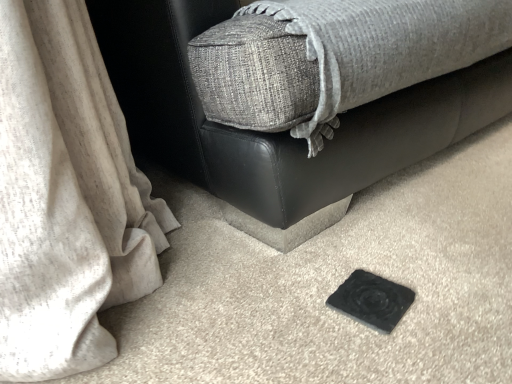
This screenshot has height=384, width=512. What do you see at coordinates (276, 133) in the screenshot?
I see `black matte coaster at lower center` at bounding box center [276, 133].

You are a GUI agent. You are given a task and a screenshot of the screen. Output one action in this format:
    pyautogui.click(x=<x>, y=<y>)
    Task: Click on the black matte coaster at lower center
    The image size is (512, 384).
    Given the screenshot: What is the action you would take?
    pyautogui.click(x=276, y=133)

Where is `black rubber pad at lower center`? The image size is (512, 384). black rubber pad at lower center is located at coordinates (372, 300).

The height and width of the screenshot is (384, 512). What do you see at coordinates (372, 300) in the screenshot?
I see `black rubber pad at lower center` at bounding box center [372, 300].

Looking at this image, in order to face black rubber pad at lower center, should I rotate leftwards or rightwards?

You should rotate right by 14.370 degrees.

Where is `black matte coaster at lower center`? This screenshot has height=384, width=512. black matte coaster at lower center is located at coordinates (276, 133).

Would you say black rubber pad at lower center is to the left or to the right of black matte coaster at lower center in the picture?

black rubber pad at lower center is positioned on black matte coaster at lower center's left side.

Is the depth of black rubber pad at lower center greater than that of black matte coaster at lower center?

Yes, it is.

Which point is more forward, (383, 286) or (101, 35)?

Positioned in front is point (383, 286).

From the image's perspective, which one is positioned higher, black rubber pad at lower center or black matte coaster at lower center?

black matte coaster at lower center.

From a real-world perspective, which is physically below, black rubber pad at lower center or black matte coaster at lower center?

black rubber pad at lower center.

Between black rubber pad at lower center and black matte coaster at lower center, which one has smaller width?

Thinner between the two is black rubber pad at lower center.

Does black rubber pad at lower center have a greater height compared to black matte coaster at lower center?

Incorrect, the height of black rubber pad at lower center is not larger of that of black matte coaster at lower center.

Looking at the image, does black rubber pad at lower center seem bigger or smaller compared to black matte coaster at lower center?

Clearly, black rubber pad at lower center is smaller in size than black matte coaster at lower center.

Is black rubber pad at lower center spatially inside black matte coaster at lower center, or outside of it?

black rubber pad at lower center is located beyond the bounds of black matte coaster at lower center.

Is black rubber pad at lower center placed right next to black matte coaster at lower center?

No, black rubber pad at lower center is not in contact with black matte coaster at lower center.

Is black rubber pad at lower center aimed at black matte coaster at lower center?

Yes, black rubber pad at lower center faces towards black matte coaster at lower center.

The width and height of the screenshot is (512, 384). I want to click on pad on the left of black matte coaster at lower center, so click(x=372, y=300).

Is black matte coaster at lower center to the left of black rubber pad at lower center from the viewer's perspective?

No, black matte coaster at lower center is not to the left of black rubber pad at lower center.

In the image, is black matte coaster at lower center positioned in front of or behind black rubber pad at lower center?

black matte coaster at lower center is in front of black rubber pad at lower center.

Is point (350, 180) closer to viewer compared to point (355, 311)?

No, (350, 180) is further to viewer.

From the image's perspective, is black matte coaster at lower center above black rubber pad at lower center?

Yes, from the image's perspective, black matte coaster at lower center is above black rubber pad at lower center.

From a real-world perspective, is black matte coaster at lower center physically located above or below black rubber pad at lower center?

black matte coaster at lower center is above black rubber pad at lower center.

Considering the relative sizes of black matte coaster at lower center and black rubber pad at lower center in the image provided, is black matte coaster at lower center wider than black rubber pad at lower center?

Yes.

Considering the sizes of objects black matte coaster at lower center and black rubber pad at lower center in the image provided, who is shorter, black matte coaster at lower center or black rubber pad at lower center?

black rubber pad at lower center is shorter.

Who is smaller, black matte coaster at lower center or black rubber pad at lower center?

Smaller between the two is black rubber pad at lower center.

Is black matte coaster at lower center positioned beyond the bounds of black rubber pad at lower center?

Yes.

Is black matte coaster at lower center touching black rubber pad at lower center?

No, black matte coaster at lower center is not next to black rubber pad at lower center.

Does black matte coaster at lower center turn towards black rubber pad at lower center?

Yes, black matte coaster at lower center is turned towards black rubber pad at lower center.

Identify the location of pad on the left side of black matte coaster at lower center. This screenshot has height=384, width=512. (372, 300).

At what (x,y) coordinates should I click in order to perform the action: click on pad below the black matte coaster at lower center (from a real-world perspective). Please return your answer as a coordinate pair (x, y). The width and height of the screenshot is (512, 384). Looking at the image, I should click on (372, 300).

The image size is (512, 384). Identify the location of furniture in front of the black rubber pad at lower center. (276, 133).